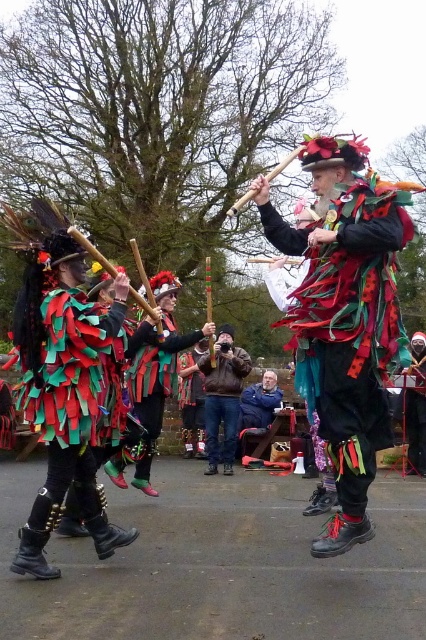
Question: Does shiny metallic costume at center appear on the left side of green fabric mask at center?

Choices:
 (A) yes
 (B) no

Answer: (B)

Question: Is multicolored fabric costume at center above shiny metallic costume at center?

Choices:
 (A) no
 (B) yes

Answer: (B)

Question: Which object appears farthest from the camera in this image?

Choices:
 (A) green fabric mask at center
 (B) brown leather jacket at center
 (C) shiny metallic costume at center

Answer: (B)

Question: Is multicolored fabric costume at center further to camera compared to shiny metallic costume at center?

Choices:
 (A) yes
 (B) no

Answer: (A)

Question: Among these points, which one is nearest to the camera?

Choices:
 (A) (328, 172)
 (B) (218, 344)
 (C) (166, 365)
 (D) (356, 154)

Answer: (D)

Question: Based on their relative distances, which object is nearer to the shiny metallic costume at center?

Choices:
 (A) brown leather jacket at center
 (B) green fabric mask at center
 (C) multicolored fabric costume at center

Answer: (C)